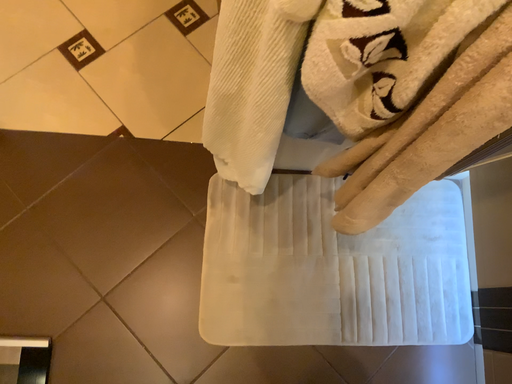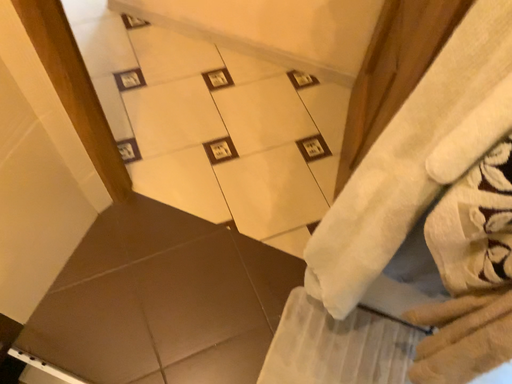
Question: How did the camera likely rotate when shooting the video?

Choices:
 (A) rotated downward
 (B) rotated upward

Answer: (B)